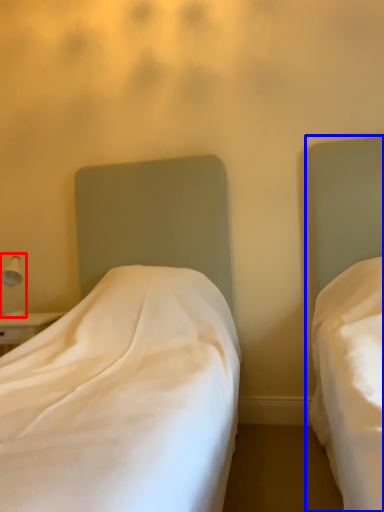
Question: Which object appears closest to the camera in this image, bedside lamp (highlighted by a red box) or bed (highlighted by a blue box)?

Choices:
 (A) bedside lamp
 (B) bed

Answer: (B)